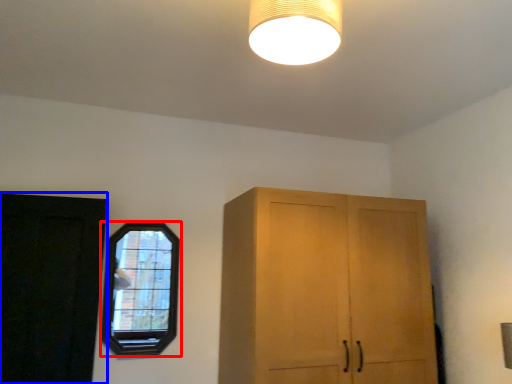
Question: Which object appears closest to the camera in this image, window (highlighted by a red box) or door (highlighted by a blue box)?

Choices:
 (A) window
 (B) door

Answer: (B)